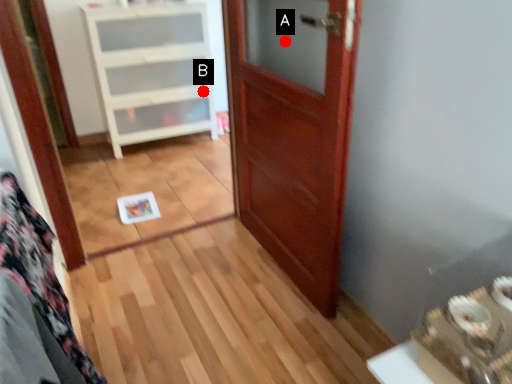
Question: Two points are circled on the image, labeled by A and B beside each circle. Which of the following is the closest to the observer?

Choices:
 (A) A is closer
 (B) B is closer

Answer: (A)